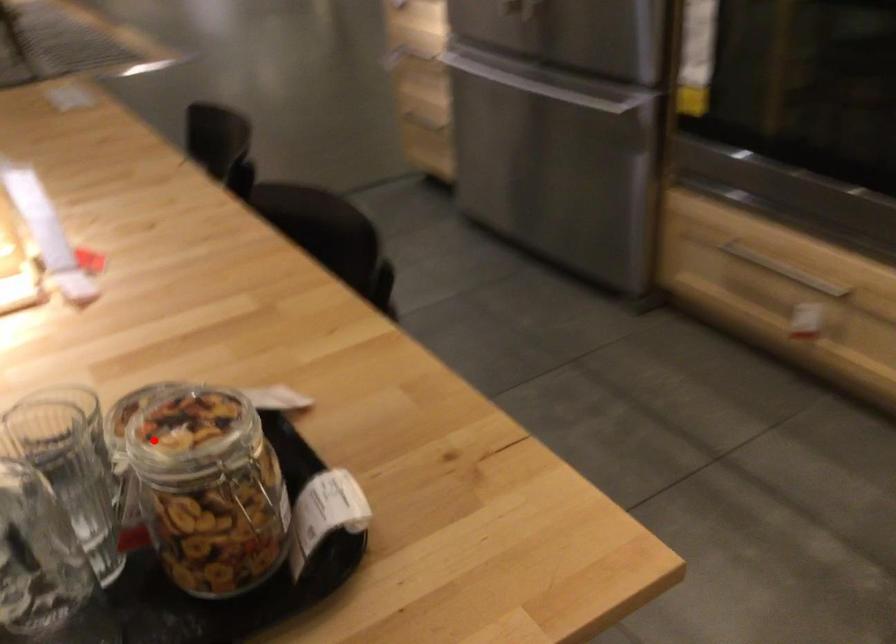
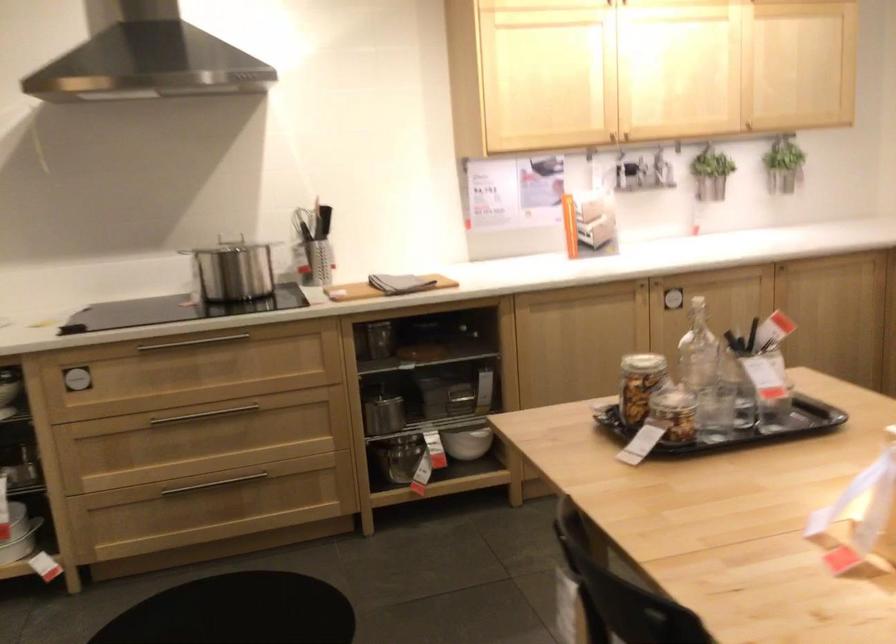
Question: I am providing you with two images of the same scene from different viewpoints. A red point is shown in image1. For the corresponding object point in image2, is it positioned nearer or farther from the camera?

Choices:
 (A) Nearer
 (B) Farther

Answer: (B)